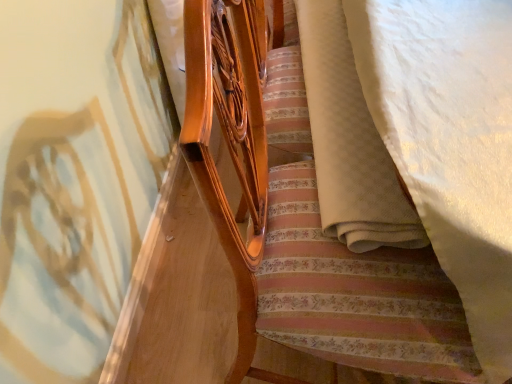
Question: Is white textured blanket at lower right thinner than matte wood bed frame at center?

Choices:
 (A) yes
 (B) no

Answer: (A)

Question: Can you confirm if white textured blanket at lower right is bigger than matte wood bed frame at center?

Choices:
 (A) no
 (B) yes

Answer: (A)

Question: From a real-world perspective, is white textured blanket at lower right physically below matte wood bed frame at center?

Choices:
 (A) no
 (B) yes

Answer: (A)

Question: Can you confirm if white textured blanket at lower right is taller than matte wood bed frame at center?

Choices:
 (A) no
 (B) yes

Answer: (A)

Question: Could matte wood bed frame at center be considered to be inside white textured blanket at lower right?

Choices:
 (A) yes
 (B) no

Answer: (B)

Question: Are white textured blanket at lower right and matte wood bed frame at center far apart?

Choices:
 (A) no
 (B) yes

Answer: (A)

Question: Is matte wood bed frame at center at the right side of white textured blanket at lower right?

Choices:
 (A) no
 (B) yes

Answer: (A)

Question: Can you confirm if matte wood bed frame at center is thinner than white textured blanket at lower right?

Choices:
 (A) yes
 (B) no

Answer: (B)

Question: Would you say matte wood bed frame at center contains white textured blanket at lower right?

Choices:
 (A) no
 (B) yes

Answer: (B)

Question: From a real-world perspective, does matte wood bed frame at center sit lower than white textured blanket at lower right?

Choices:
 (A) yes
 (B) no

Answer: (A)

Question: Is matte wood bed frame at center smaller than white textured blanket at lower right?

Choices:
 (A) no
 (B) yes

Answer: (A)

Question: Is white textured blanket at lower right at the back of matte wood bed frame at center?

Choices:
 (A) no
 (B) yes

Answer: (A)

Question: In terms of width, does white textured blanket at lower right look wider or thinner when compared to matte wood bed frame at center?

Choices:
 (A) thin
 (B) wide

Answer: (A)